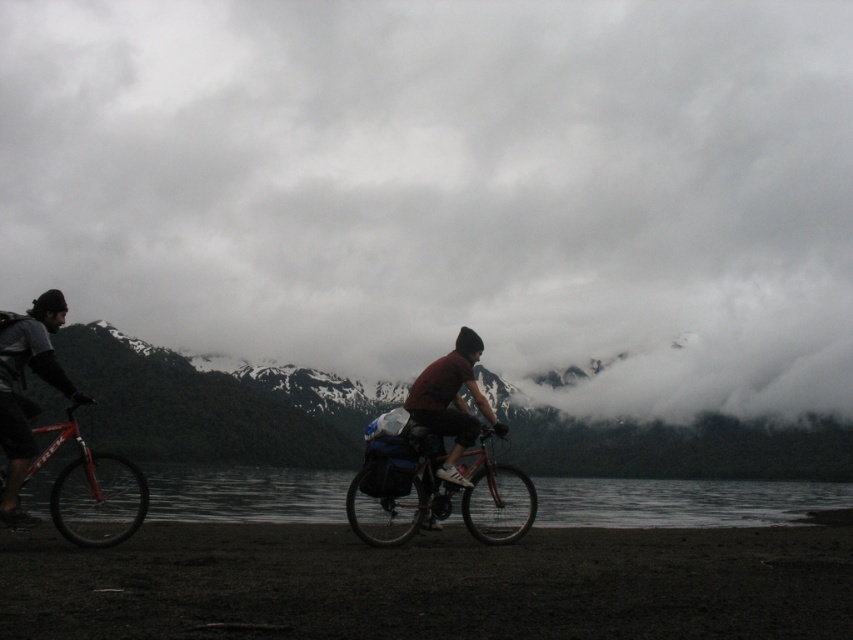
Question: Is cloudy sky at upper center to the right of dark sand shoreline at lower center from the viewer's perspective?

Choices:
 (A) no
 (B) yes

Answer: (A)

Question: Which object is closer to the camera taking this photo?

Choices:
 (A) transparent water at lower center
 (B) shiny metallic bicycle at center
 (C) matte black jacket at left
 (D) dark sand shoreline at lower center

Answer: (D)

Question: Which object is closer to the camera taking this photo?

Choices:
 (A) cloudy sky at upper center
 (B) dark sand shoreline at lower center
 (C) matte black jacket at left

Answer: (B)

Question: Does shiny metallic bicycle at center have a greater width compared to matte black jacket at left?

Choices:
 (A) no
 (B) yes

Answer: (B)

Question: Among these points, which one is nearest to the camera?

Choices:
 (A) (840, 10)
 (B) (416, 460)

Answer: (B)

Question: Observing the image, what is the correct spatial positioning of transparent water at lower center in reference to shiny red bike at left?

Choices:
 (A) right
 (B) left

Answer: (A)